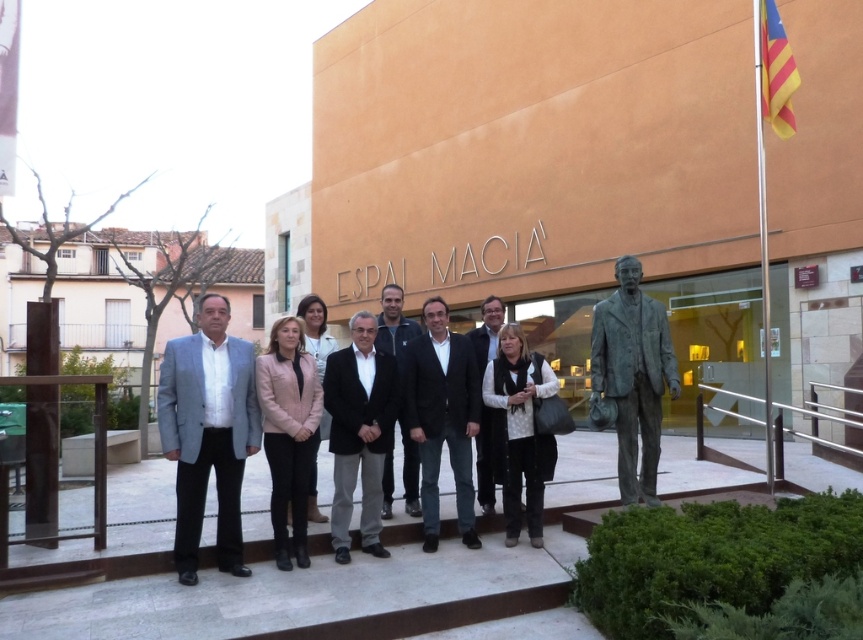
Question: Which of these objects is positioned closest to the light gray suit at center?

Choices:
 (A) black textured sweater at center
 (B) black suit at center

Answer: (B)

Question: Does light gray suit at center appear under bronze statue at right?

Choices:
 (A) yes
 (B) no

Answer: (A)

Question: Is black suit at center wider than black textured sweater at center?

Choices:
 (A) no
 (B) yes

Answer: (B)

Question: Estimate the real-world distances between objects in this image. Which object is farther from the black suit at center?

Choices:
 (A) black textured sweater at center
 (B) light gray suit at center
 (C) black matte suit at center
 (D) black matte jacket at center

Answer: (B)

Question: Which object is closer to the camera taking this photo?

Choices:
 (A) black matte jacket at center
 (B) light gray suit at center
 (C) bronze statue at right
 (D) matte black suit at center

Answer: (B)

Question: Can you confirm if black matte suit at center is positioned below black matte jacket at center?

Choices:
 (A) yes
 (B) no

Answer: (A)